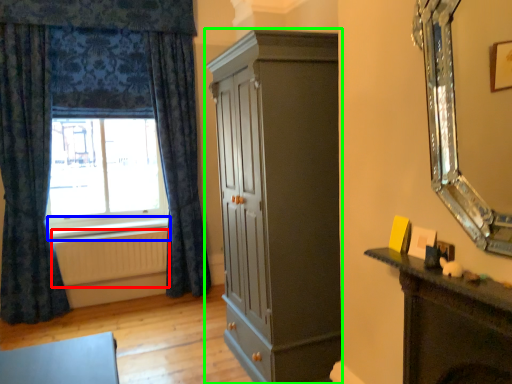
Question: Which object is the closest to the radiator (highlighted by a red box)? Choose among these: window sill (highlighted by a blue box) or cupboard (highlighted by a green box).

Choices:
 (A) window sill
 (B) cupboard

Answer: (A)